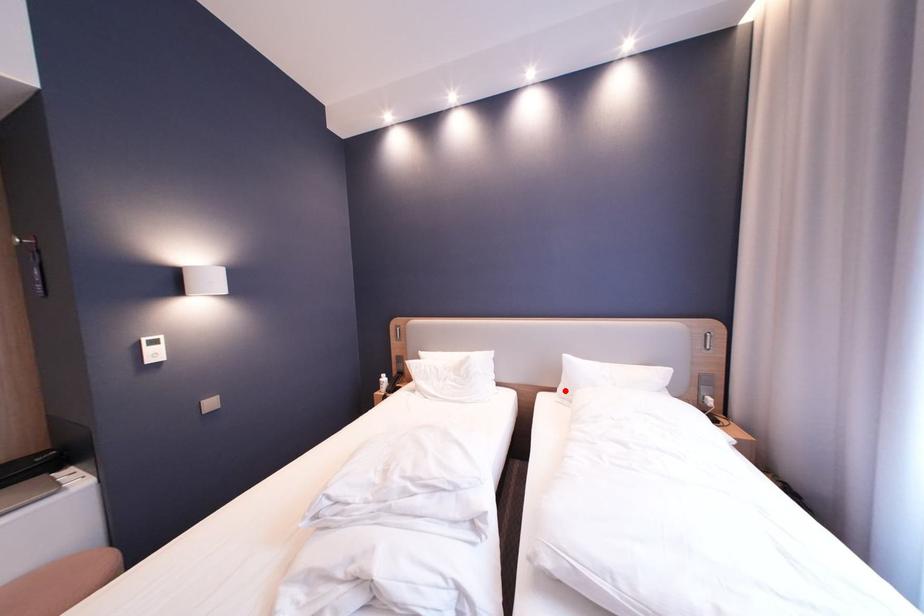
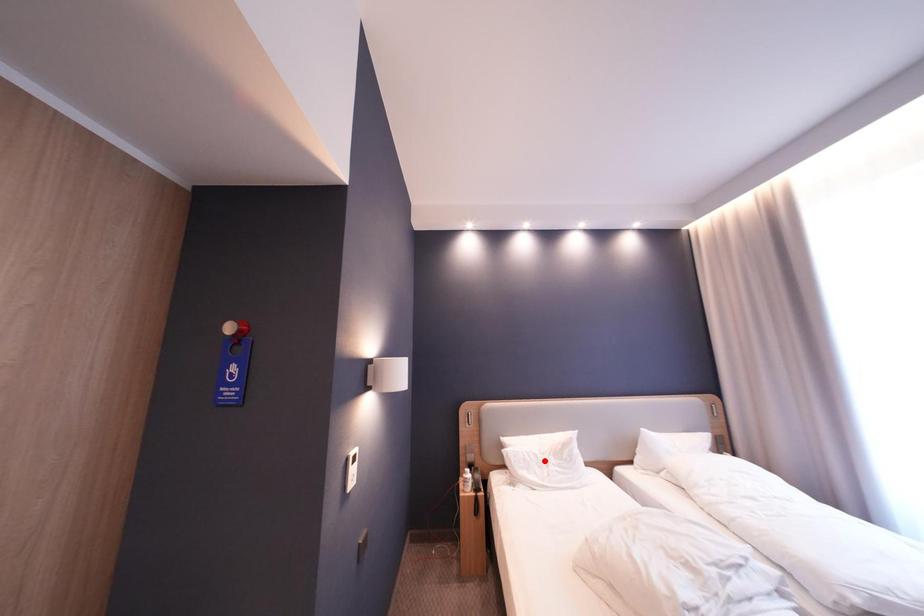
I am providing you with two images of the same scene from different viewpoints. A red point is marked on the first image and another point is marked on the second image. Is the marked point in image1 the same physical position as the marked point in image2?

No